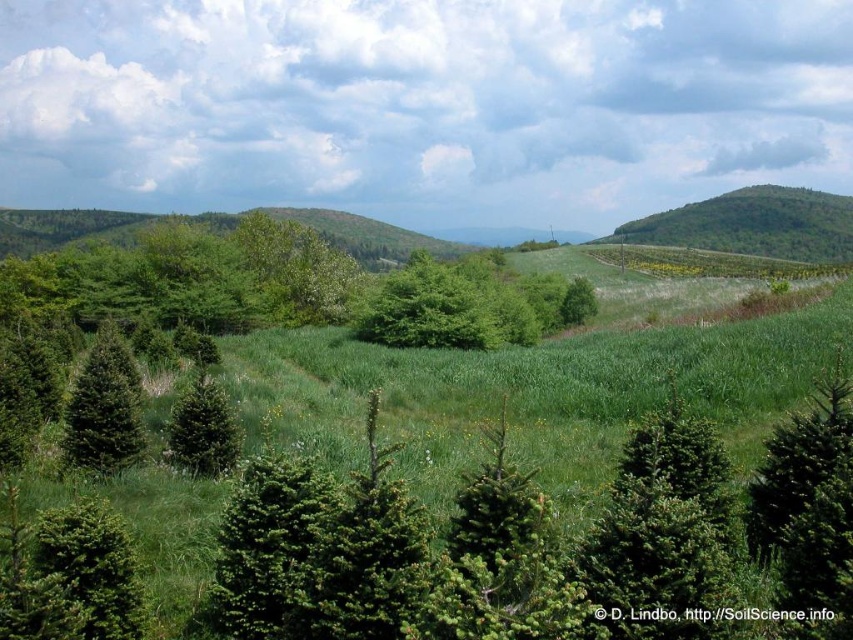
You are a hiker planning to climb the highest point visible in the scene. Which object should you ascend, the green leafy hill at upper right or the green matte evergreen tree at left?

The green leafy hill at upper right has a greater height compared to the green matte evergreen tree at left, so you should ascend the green leafy hill at upper right to reach the highest point visible in the scene.